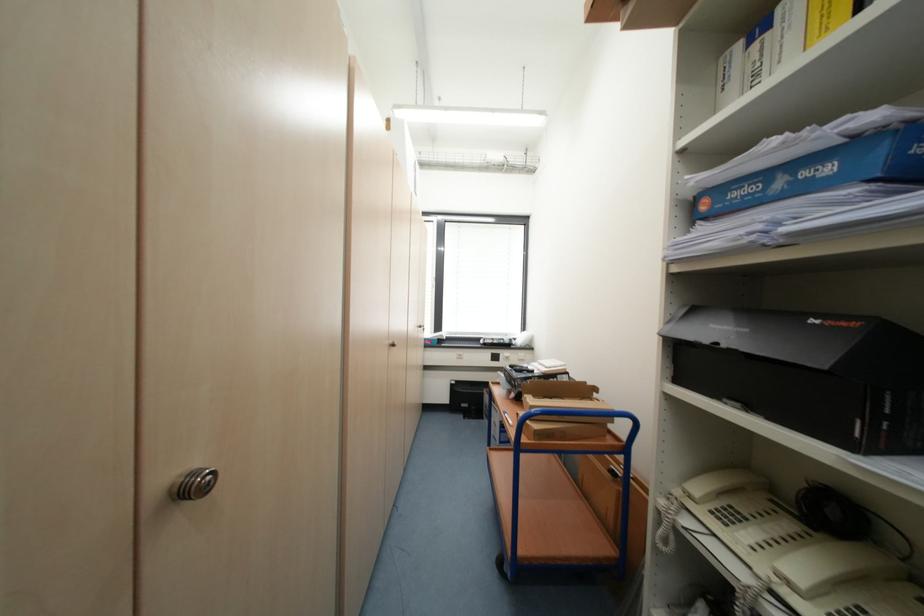
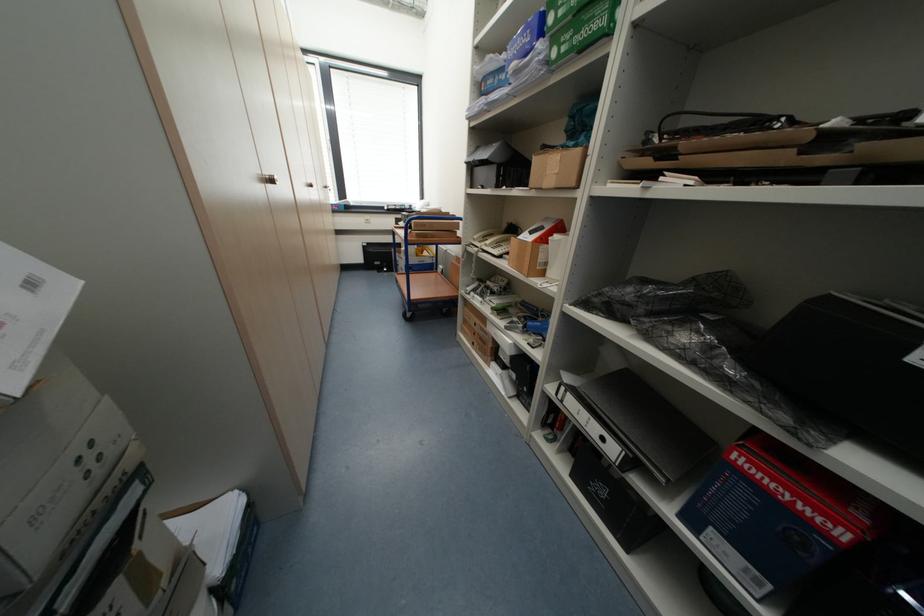
Find the pixel in the second image that matches point (697, 498) in the first image.

(480, 240)